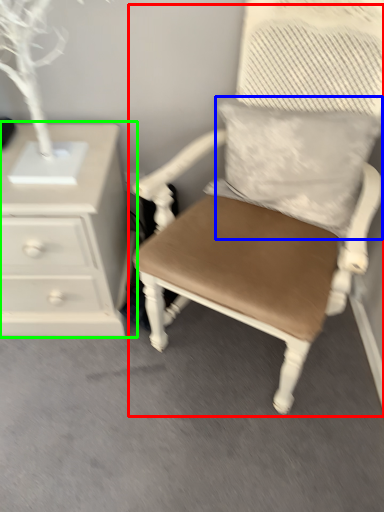
Question: Which object is positioned farthest from chair (highlighted by a red box)? Select from pillow (highlighted by a blue box) and chest of drawers (highlighted by a green box).

Choices:
 (A) pillow
 (B) chest of drawers

Answer: (B)